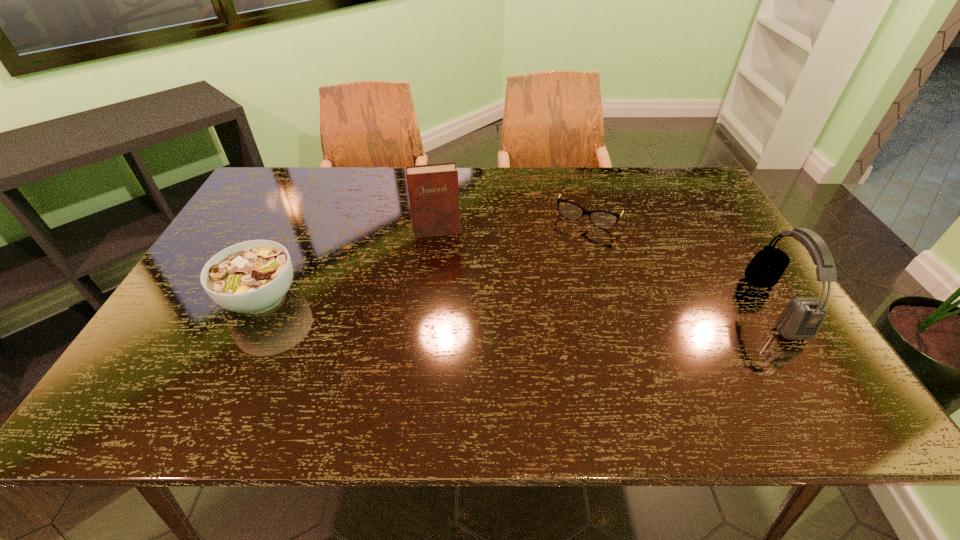
Locate an element on the screen. The height and width of the screenshot is (540, 960). vacant region at the left edge of the desktop is located at coordinates (204, 322).

Locate an element on the screen. vacant area at the right edge of the desktop is located at coordinates (729, 259).

Identify the location of free space at the far left corner. The image size is (960, 540). (310, 177).

Identify the location of vacant space at the far right corner. (678, 179).

You are a GUI agent. You are given a task and a screenshot of the screen. Output one action in this format:
    pyautogui.click(x=<x>, y=<y>)
    Task: Click on the vacant space at the near right corner of the desktop
    This screenshot has height=540, width=960.
    Given the screenshot: What is the action you would take?
    pyautogui.click(x=809, y=351)

Image resolution: width=960 pixels, height=540 pixels. I want to click on empty space that is in between the third object from left to right and the leftmost object, so click(x=427, y=254).

Locate an element on the screen. empty space between the shortest object and the soup bowl is located at coordinates (427, 254).

This screenshot has width=960, height=540. Identify the location of vacant space in between the leftmost object and the headset. (517, 302).

You are a GUI agent. You are given a task and a screenshot of the screen. Output one action in this format:
    pyautogui.click(x=<x>, y=<y>)
    Task: Click on the free space that is in between the third tallest object and the shortest object
    The height and width of the screenshot is (540, 960).
    Given the screenshot: What is the action you would take?
    pyautogui.click(x=427, y=254)

Where is `vacant region between the second object from left to right and the spectacles`? The height and width of the screenshot is (540, 960). vacant region between the second object from left to right and the spectacles is located at coordinates (515, 221).